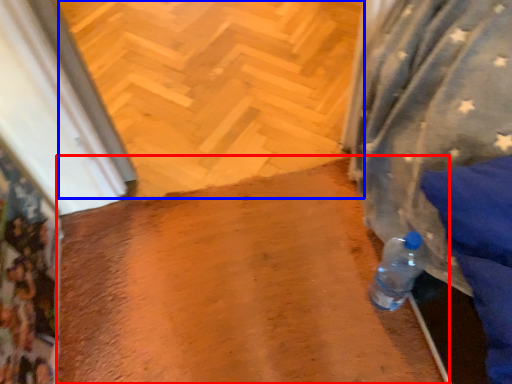
Question: Among these objects, which one is nearest to the camera, wide (highlighted by a red box) or path (highlighted by a blue box)?

Choices:
 (A) wide
 (B) path

Answer: (A)